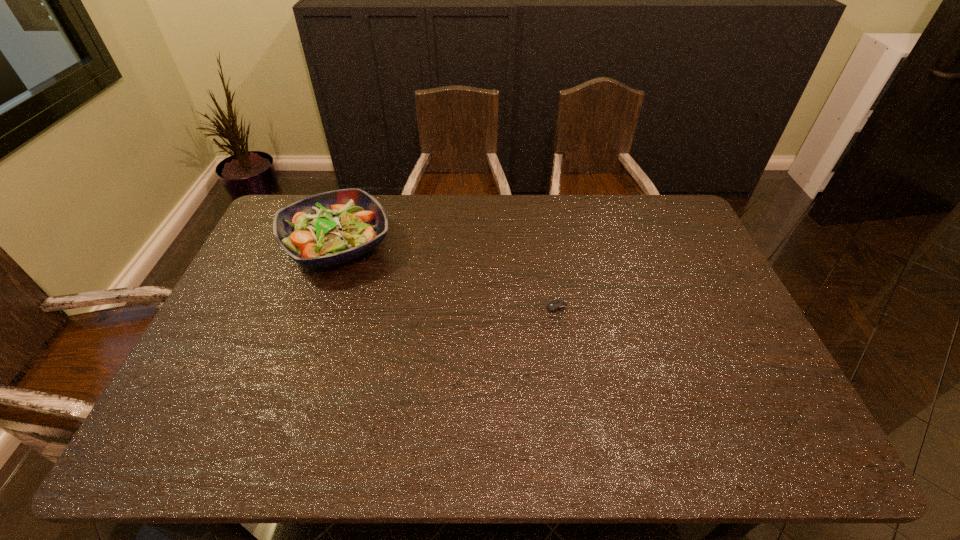
Identify the location of the left object. (329, 228).

Where is `salad plate`? salad plate is located at coordinates (329, 228).

Image resolution: width=960 pixels, height=540 pixels. Find the location of `the nearer object`. the nearer object is located at coordinates (555, 305).

The width and height of the screenshot is (960, 540). In order to click on the right object in this screenshot , I will do `click(555, 305)`.

In order to click on free space located 0.050m on the right of the taller object in this screenshot , I will do `click(409, 245)`.

In order to click on free space located 0.280m on the left of the shorter object in this screenshot , I will do `click(441, 315)`.

Identify the location of object located at the far edge. [x=329, y=228].

I want to click on object located in the left edge section of the desktop, so click(329, 228).

Find the location of a particular element. The image size is (960, 540). object positioned at the far left corner is located at coordinates (329, 228).

In the image, there is a desktop. Where is `blank space at the far edge`? The width and height of the screenshot is (960, 540). blank space at the far edge is located at coordinates [484, 231].